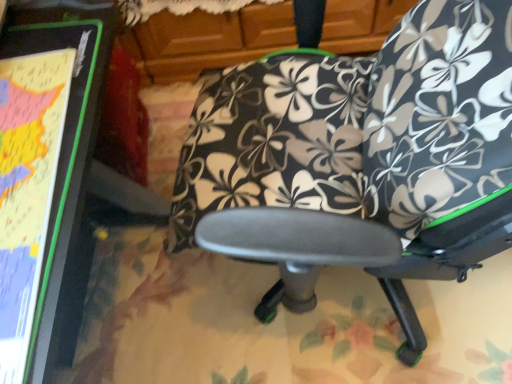
Locate an element on the screen. black floral fabric bean bag chair at center is located at coordinates (440, 112).

Is black floral fabric bean bag chair at center aimed at black fabric chair at center?

Yes, black floral fabric bean bag chair at center is aimed at black fabric chair at center.

Is the surface of black floral fabric bean bag chair at center in direct contact with black fabric chair at center?

Yes, black floral fabric bean bag chair at center is in contact with black fabric chair at center.

From a real-world perspective, who is located higher, black floral fabric bean bag chair at center or black fabric chair at center?

In real-world perspective, black floral fabric bean bag chair at center is above.

Is the depth of black fabric chair at center greater than that of matte black board at left?

No.

Which is farther, (460,117) or (30,190)?

The point (460,117) is farther from the camera.

From the image's perspective, is black fabric chair at center beneath matte black board at left?

No, from the image's perspective, black fabric chair at center is not below matte black board at left.

In terms of width, does black fabric chair at center look wider or thinner when compared to matte black board at left?

In the image, black fabric chair at center appears to be wider than matte black board at left.

From a real-world perspective, between matte black board at left and black fabric chair at center, who is vertically lower?

matte black board at left, from a real-world perspective.

Consider the image. How different are the orientations of matte black board at left and black fabric chair at center in degrees?

They differ by 132 degrees in their facing directions.

Is matte black board at left looking in the opposite direction of black fabric chair at center?

No.

Is matte black board at left in contact with black floral fabric bean bag chair at center?

No, matte black board at left is not making contact with black floral fabric bean bag chair at center.

Considering the relative positions of matte black board at left and black floral fabric bean bag chair at center in the image provided, is matte black board at left to the left or to the right of black floral fabric bean bag chair at center?

From the image, it's evident that matte black board at left is to the left of black floral fabric bean bag chair at center.

What's the angular difference between matte black board at left and black floral fabric bean bag chair at center's facing directions?

The facing directions of matte black board at left and black floral fabric bean bag chair at center are 138 degrees apart.

This screenshot has height=384, width=512. I want to click on bulletin board on the left of black floral fabric bean bag chair at center, so click(x=44, y=166).

Does black fabric chair at center have a greater height compared to black floral fabric bean bag chair at center?

Yes.

Does black fabric chair at center appear on the left side of black floral fabric bean bag chair at center?

Correct, you'll find black fabric chair at center to the left of black floral fabric bean bag chair at center.

From the picture: Can you confirm if black fabric chair at center is wider than black floral fabric bean bag chair at center?

Correct, the width of black fabric chair at center exceeds that of black floral fabric bean bag chair at center.

Between point (368, 139) and point (454, 179), which one is positioned behind?

Point (368, 139)

From the image's perspective, between black floral fabric bean bag chair at center and matte black board at left, which one is located above?

black floral fabric bean bag chair at center.

Is black floral fabric bean bag chair at center turned away from matte black board at left?

No, black floral fabric bean bag chair at center is not facing the opposite direction of matte black board at left.

Looking at their sizes, would you say black floral fabric bean bag chair at center is wider or thinner than matte black board at left?

Considering their sizes, black floral fabric bean bag chair at center looks slimmer than matte black board at left.

Image resolution: width=512 pixels, height=384 pixels. Identify the location of chair on the left of black floral fabric bean bag chair at center. (370, 143).

Where is `bulletin board below the black fabric chair at center (from the image's perspective)`? bulletin board below the black fabric chair at center (from the image's perspective) is located at coordinates (44, 166).

Estimate the real-world distances between objects in this image. Which object is closer to black floral fabric bean bag chair at center, black fabric chair at center or matte black board at left?

Based on the image, black fabric chair at center appears to be nearer to black floral fabric bean bag chair at center.

Looking at the image, which one is located further to black floral fabric bean bag chair at center, matte black board at left or black fabric chair at center?

matte black board at left lies further to black floral fabric bean bag chair at center than the other object.

Considering their positions, is black floral fabric bean bag chair at center positioned closer to black fabric chair at center than matte black board at left?

black floral fabric bean bag chair at center lies closer to black fabric chair at center than the other object.

Estimate the real-world distances between objects in this image. Which object is closer to black fabric chair at center, matte black board at left or black floral fabric bean bag chair at center?

black floral fabric bean bag chair at center is positioned closer to the anchor black fabric chair at center.

Based on their spatial positions, is black fabric chair at center or black floral fabric bean bag chair at center closer to matte black board at left?

black fabric chair at center.

Based on their spatial positions, is black floral fabric bean bag chair at center or black fabric chair at center further from matte black board at left?

Based on the image, black floral fabric bean bag chair at center appears to be further to matte black board at left.

I want to click on chair located between matte black board at left and black floral fabric bean bag chair at center in the left-right direction, so click(370, 143).